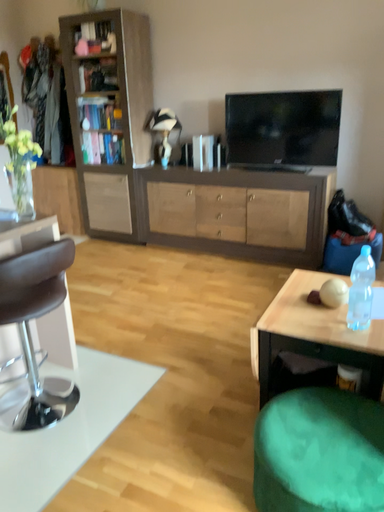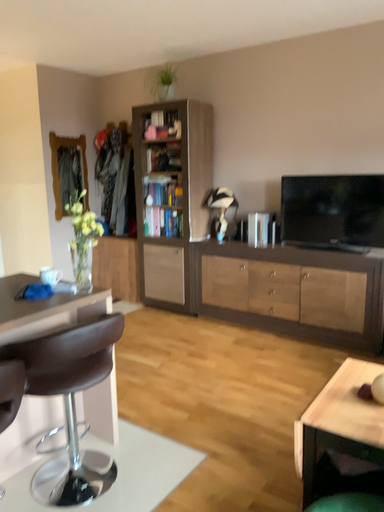
Question: How did the camera likely rotate when shooting the video?

Choices:
 (A) rotated right
 (B) rotated left

Answer: (B)